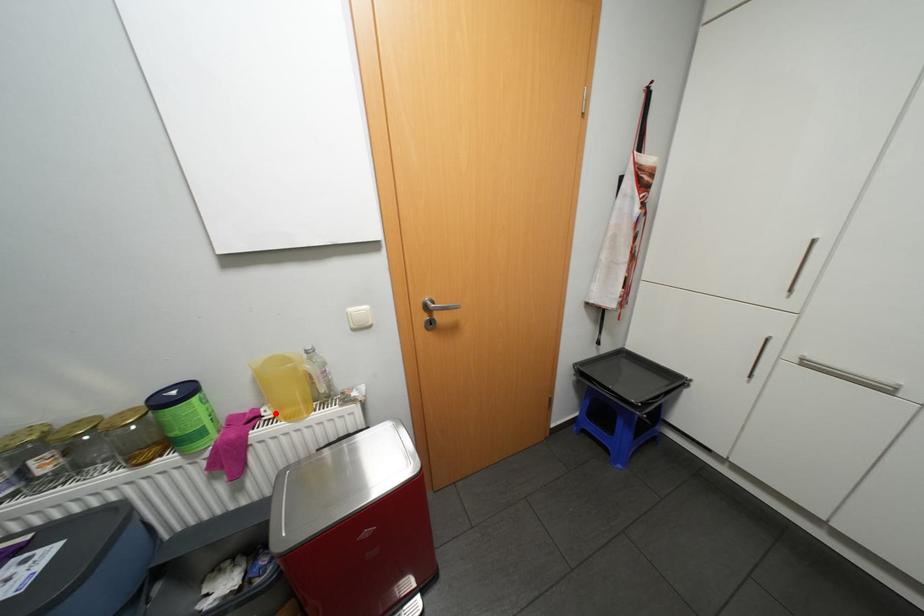
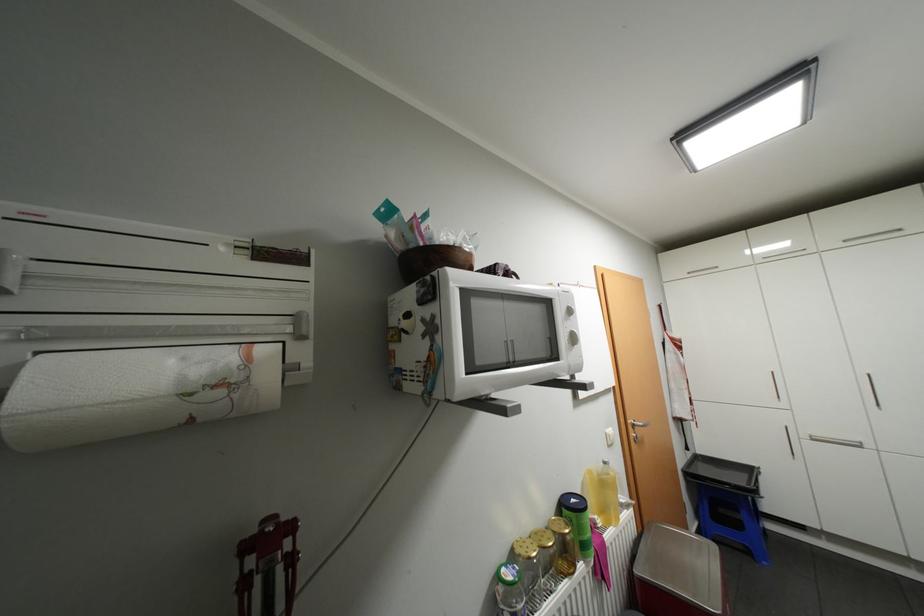
Question: I am providing you with two images of the same scene from different viewpoints. A red point is shown in image1. For the corresponding object point in image2, is it positioned nearer or farther from the camera?

Choices:
 (A) Nearer
 (B) Farther

Answer: (B)